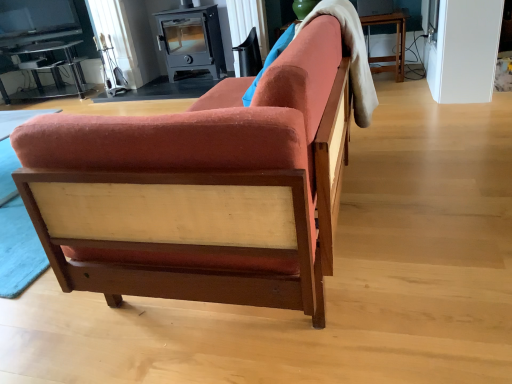
Question: Does point (205, 13) appear closer or farther from the camera than point (151, 261)?

Choices:
 (A) closer
 (B) farther

Answer: (B)

Question: From the image's perspective, is metallic wood-burning stove at upper center above or below velvet orange couch at center?

Choices:
 (A) above
 (B) below

Answer: (A)

Question: Based on their relative distances, which object is nearer to the matte black swivel chair at upper center?

Choices:
 (A) metallic wood-burning stove at upper center
 (B) clear glass table at upper left
 (C) velvet orange couch at center

Answer: (A)

Question: Which object is the closest to the metallic wood-burning stove at upper center?

Choices:
 (A) velvet orange couch at center
 (B) clear glass table at upper left
 (C) matte black swivel chair at upper center

Answer: (C)